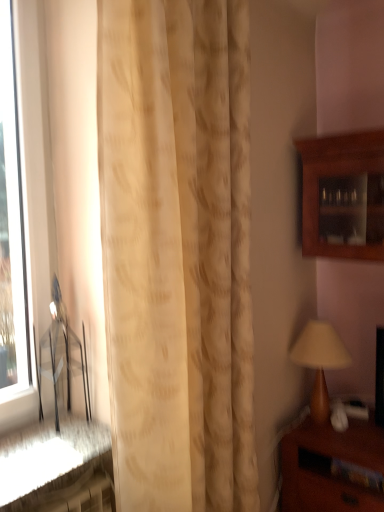
Question: From a real-world perspective, is transparent glass window at left on top of beige textured curtain at center?

Choices:
 (A) yes
 (B) no

Answer: (A)

Question: Does transparent glass window at left contain beige textured curtain at center?

Choices:
 (A) no
 (B) yes

Answer: (A)

Question: Considering the relative sizes of transparent glass window at left and beige textured curtain at center in the image provided, is transparent glass window at left shorter than beige textured curtain at center?

Choices:
 (A) yes
 (B) no

Answer: (A)

Question: From the image's perspective, would you say transparent glass window at left is positioned over beige textured curtain at center?

Choices:
 (A) no
 (B) yes

Answer: (B)

Question: Is transparent glass window at left next to beige textured curtain at center?

Choices:
 (A) no
 (B) yes

Answer: (A)

Question: Considering the positions of point (380, 498) and point (370, 245), is point (380, 498) closer or farther from the camera than point (370, 245)?

Choices:
 (A) closer
 (B) farther

Answer: (A)

Question: Choose the correct answer: Is brown wooden nightstand at lower right inside wooden cabinet at upper right or outside it?

Choices:
 (A) inside
 (B) outside

Answer: (B)

Question: In terms of height, does brown wooden nightstand at lower right look taller or shorter compared to wooden cabinet at upper right?

Choices:
 (A) tall
 (B) short

Answer: (B)

Question: In terms of width, does brown wooden nightstand at lower right look wider or thinner when compared to wooden cabinet at upper right?

Choices:
 (A) thin
 (B) wide

Answer: (B)

Question: Based on their positions, is wooden cabinet at upper right located to the left or right of transparent glass window at left?

Choices:
 (A) right
 (B) left

Answer: (A)

Question: Considering the positions of wooden cabinet at upper right and transparent glass window at left in the image, is wooden cabinet at upper right bigger or smaller than transparent glass window at left?

Choices:
 (A) big
 (B) small

Answer: (A)

Question: In the image, is wooden cabinet at upper right positioned in front of or behind transparent glass window at left?

Choices:
 (A) behind
 (B) front

Answer: (A)

Question: From their relative heights in the image, would you say wooden cabinet at upper right is taller or shorter than transparent glass window at left?

Choices:
 (A) short
 (B) tall

Answer: (A)

Question: From the image's perspective, relative to beige textured curtain at center, is metallic silver chair at left above or below?

Choices:
 (A) below
 (B) above

Answer: (A)

Question: Considering the positions of metallic silver chair at left and beige textured curtain at center in the image, is metallic silver chair at left bigger or smaller than beige textured curtain at center?

Choices:
 (A) small
 (B) big

Answer: (A)